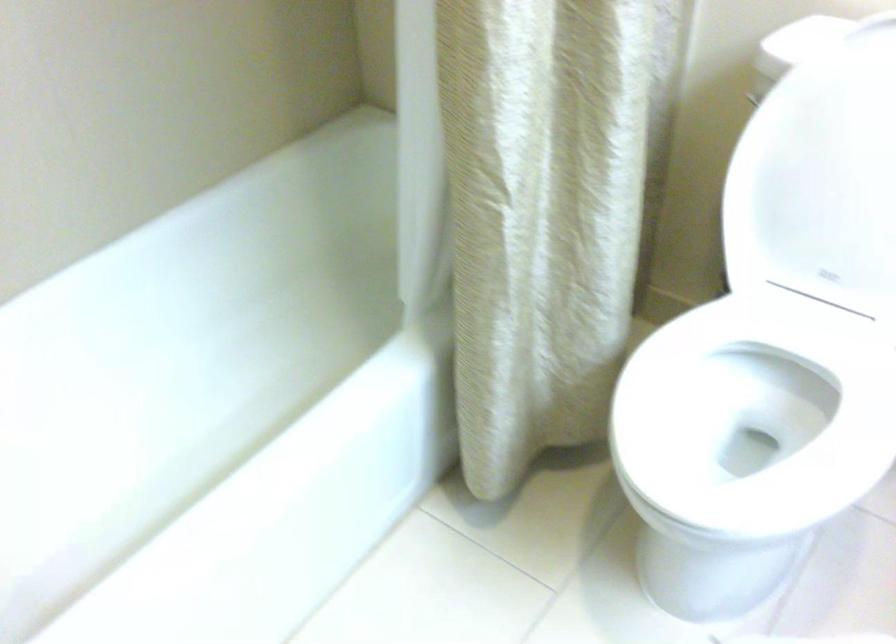
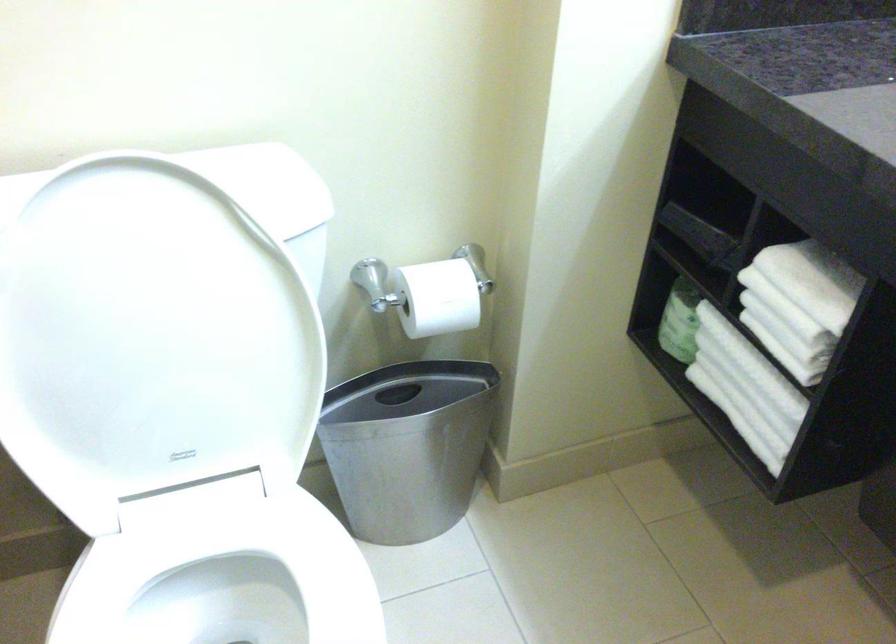
In the second image, find the point that corresponds to (x=785, y=386) in the first image.

(225, 581)